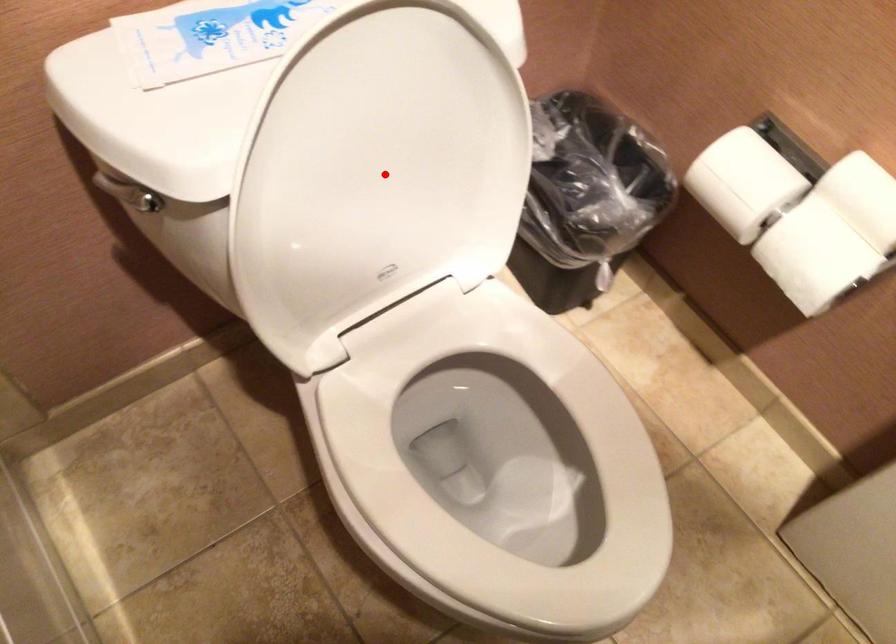
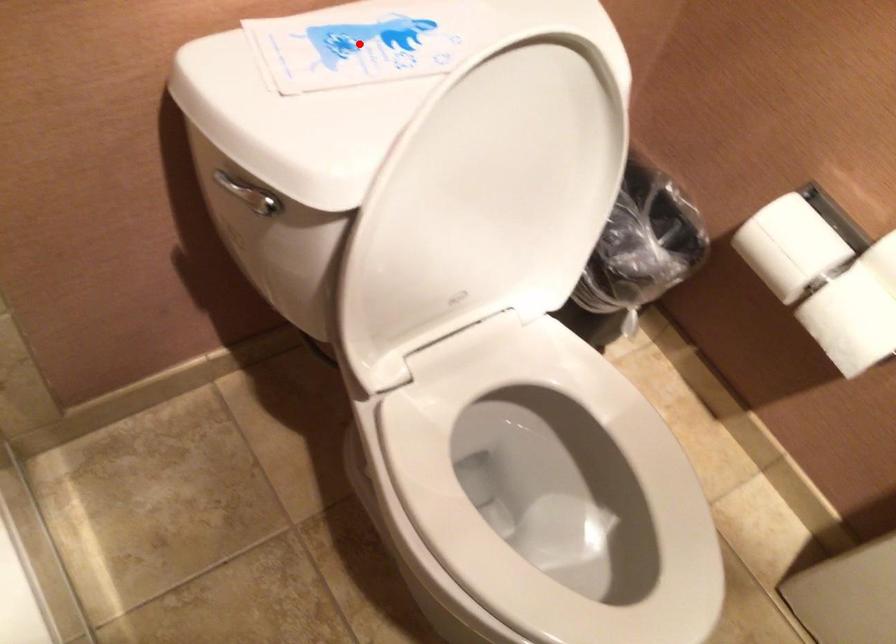
I am providing you with two images of the same scene from different viewpoints. A red point is marked on the first image and another point is marked on the second image. Does the point marked in image1 correspond to the same location as the one in image2?

No